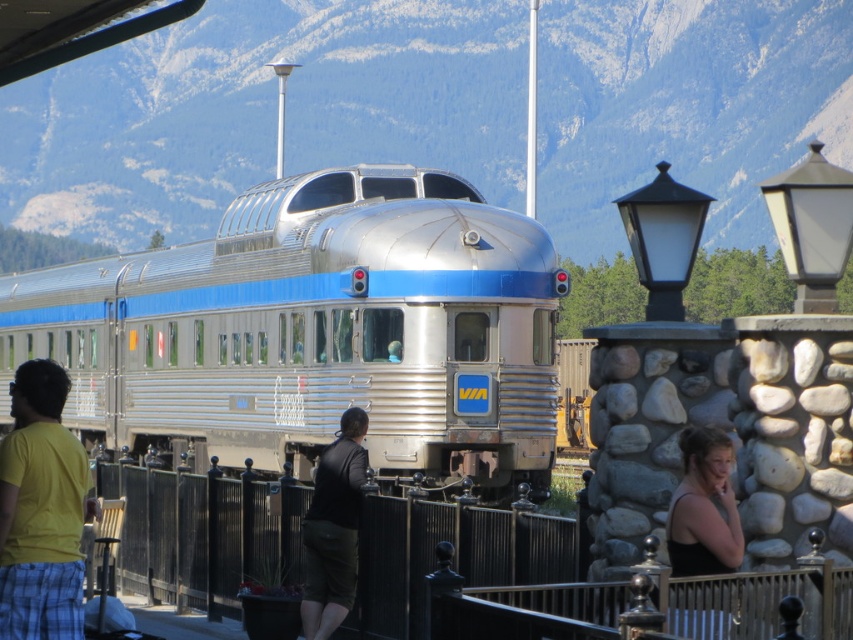
Can you confirm if silver/aluminum train at center is smaller than black tank top at lower right?

No, silver/aluminum train at center is not smaller than black tank top at lower right.

Consider the image. Is silver/aluminum train at center thinner than black tank top at lower right?

No.

Find the location of `silver/aluminum train at center`. silver/aluminum train at center is located at coordinates (317, 330).

Image resolution: width=853 pixels, height=640 pixels. I want to click on silver/aluminum train at center, so coord(317,330).

Who is higher up, yellow t-shirt at left or black tank top at lower right?

black tank top at lower right is higher up.

Which is behind, point (65, 602) or point (717, 621)?

Positioned behind is point (65, 602).

Is point (15, 573) closer to viewer compared to point (732, 449)?

That is False.

The image size is (853, 640). I want to click on yellow t-shirt at left, so click(x=41, y=509).

Does point (45, 525) come farther from viewer compared to point (328, 461)?

No.

Does yellow t-shirt at left have a smaller size compared to dark green shorts at center?

No, yellow t-shirt at left is not smaller than dark green shorts at center.

In order to click on yellow t-shirt at left in this screenshot , I will do pyautogui.click(x=41, y=509).